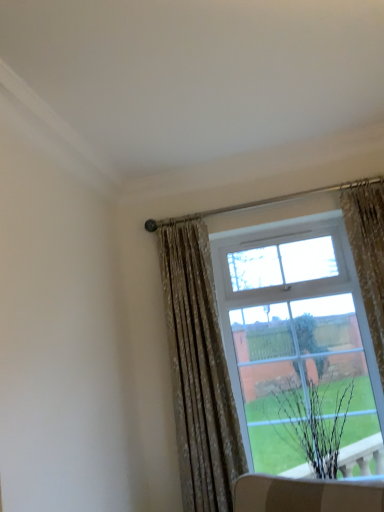
Question: Should I look upward or downward to see floral fabric curtain at right, the 1th curtain in the right-to-left sequence?

Choices:
 (A) down
 (B) up

Answer: (A)

Question: Can you confirm if floral fabric curtain at upper right, marked as the 1th curtain in a left-to-right arrangement, is taller than black matte plant at lower right?

Choices:
 (A) no
 (B) yes

Answer: (B)

Question: From the image's perspective, is floral fabric curtain at upper right, marked as the 1th curtain in a left-to-right arrangement, below black matte plant at lower right?

Choices:
 (A) no
 (B) yes

Answer: (A)

Question: Does floral fabric curtain at upper right, marked as the 1th curtain in a left-to-right arrangement, lie in front of black matte plant at lower right?

Choices:
 (A) no
 (B) yes

Answer: (B)

Question: From a real-world perspective, is floral fabric curtain at upper right, marked as the 1th curtain in a left-to-right arrangement, on top of black matte plant at lower right?

Choices:
 (A) yes
 (B) no

Answer: (A)

Question: Is floral fabric curtain at upper right, marked as the 1th curtain in a left-to-right arrangement, looking in the opposite direction of black matte plant at lower right?

Choices:
 (A) no
 (B) yes

Answer: (A)

Question: From a real-world perspective, is floral fabric curtain at upper right, marked as the 1th curtain in a left-to-right arrangement, under black matte plant at lower right?

Choices:
 (A) no
 (B) yes

Answer: (A)

Question: From a real-world perspective, is black matte plant at lower right on top of floral fabric curtain at right, placed as the second curtain when sorted from left to right?

Choices:
 (A) no
 (B) yes

Answer: (A)

Question: Is black matte plant at lower right outside floral fabric curtain at right, the 1th curtain in the right-to-left sequence?

Choices:
 (A) yes
 (B) no

Answer: (A)

Question: Is black matte plant at lower right smaller than floral fabric curtain at right, the 1th curtain in the right-to-left sequence?

Choices:
 (A) yes
 (B) no

Answer: (B)

Question: Is black matte plant at lower right not close to floral fabric curtain at right, placed as the second curtain when sorted from left to right?

Choices:
 (A) no
 (B) yes

Answer: (A)

Question: Is floral fabric curtain at right, placed as the second curtain when sorted from left to right, completely or partially inside black matte plant at lower right?

Choices:
 (A) yes
 (B) no

Answer: (B)

Question: Is black matte plant at lower right at the left side of floral fabric curtain at right, the 1th curtain in the right-to-left sequence?

Choices:
 (A) yes
 (B) no

Answer: (A)

Question: From the image's perspective, does floral fabric curtain at right, the 1th curtain in the right-to-left sequence, appear lower than black matte plant at lower right?

Choices:
 (A) yes
 (B) no

Answer: (B)